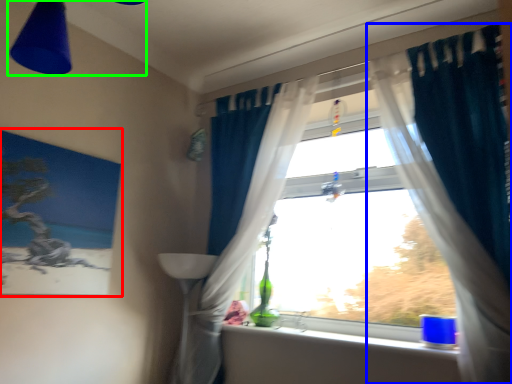
Question: Which object is positioned closest to picture frame (highlighted by a red box)? Select from curtain (highlighted by a blue box) and light fixture (highlighted by a green box).

Choices:
 (A) curtain
 (B) light fixture

Answer: (B)